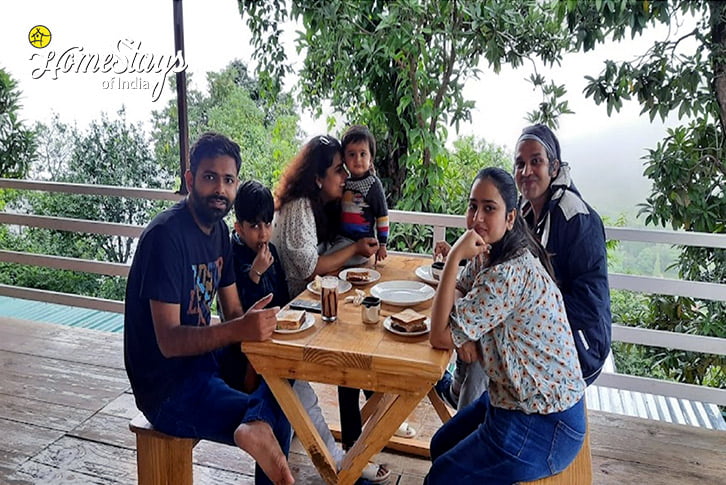
Where is `plates`? plates is located at coordinates (398, 281), (375, 274), (342, 287), (303, 324), (391, 329), (425, 273).